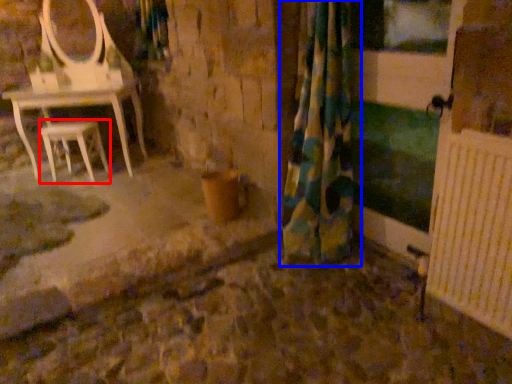
Question: Which object appears closest to the camera in this image, stool (highlighted by a red box) or curtain (highlighted by a blue box)?

Choices:
 (A) stool
 (B) curtain

Answer: (B)